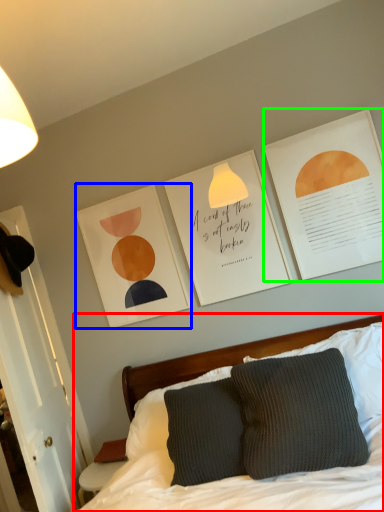
Question: Which is nearer to the bed (highlighted by a red box)? picture frame (highlighted by a blue box) or postcard (highlighted by a green box).

Choices:
 (A) picture frame
 (B) postcard

Answer: (A)